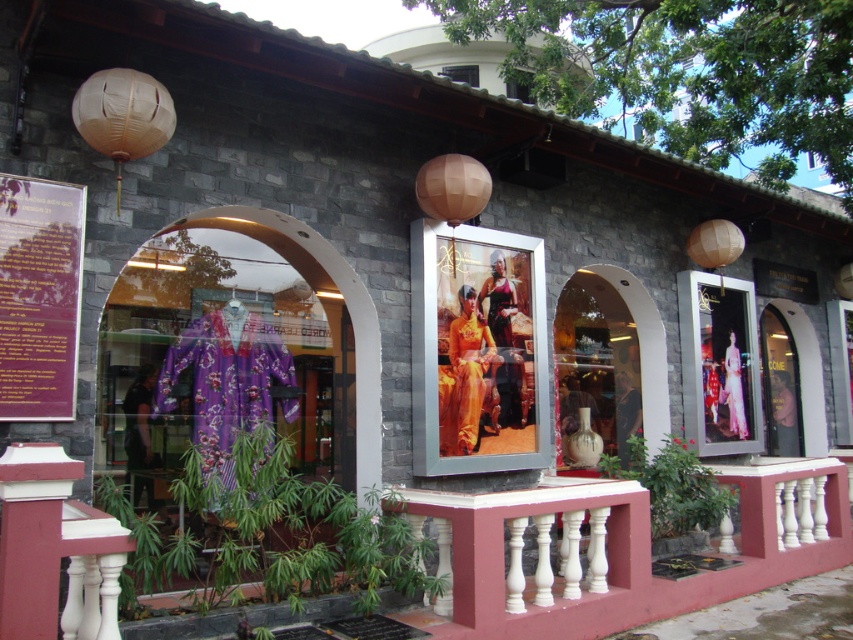
Is purple paper at left to the right of transparent glass window at center from the viewer's perspective?

In fact, purple paper at left is to the left of transparent glass window at center.

Can you confirm if purple paper at left is positioned above transparent glass window at center?

Actually, purple paper at left is below transparent glass window at center.

Is point (16, 230) positioned behind point (517, 90)?

No, (16, 230) is in front of (517, 90).

The height and width of the screenshot is (640, 853). In order to click on purple paper at left in this screenshot , I will do `click(39, 296)`.

From the picture: Who is shorter, metallic silver frame at center or white painted wood balustrade at center?

white painted wood balustrade at center

Which is more to the left, metallic silver frame at center or white painted wood balustrade at center?

metallic silver frame at center

Is point (531, 336) closer to viewer compared to point (636, 492)?

No, (531, 336) is further to viewer.

I want to click on metallic silver frame at center, so [x=477, y=349].

Does metallic silver frame at center come behind matte glass window at center?

No, metallic silver frame at center is closer to the viewer.

Is metallic silver frame at center to the right of matte glass window at center from the viewer's perspective?

In fact, metallic silver frame at center is to the left of matte glass window at center.

What do you see at coordinates (477, 349) in the screenshot? The width and height of the screenshot is (853, 640). I see `metallic silver frame at center` at bounding box center [477, 349].

Where is `metallic silver frame at center`? The image size is (853, 640). metallic silver frame at center is located at coordinates (x=477, y=349).